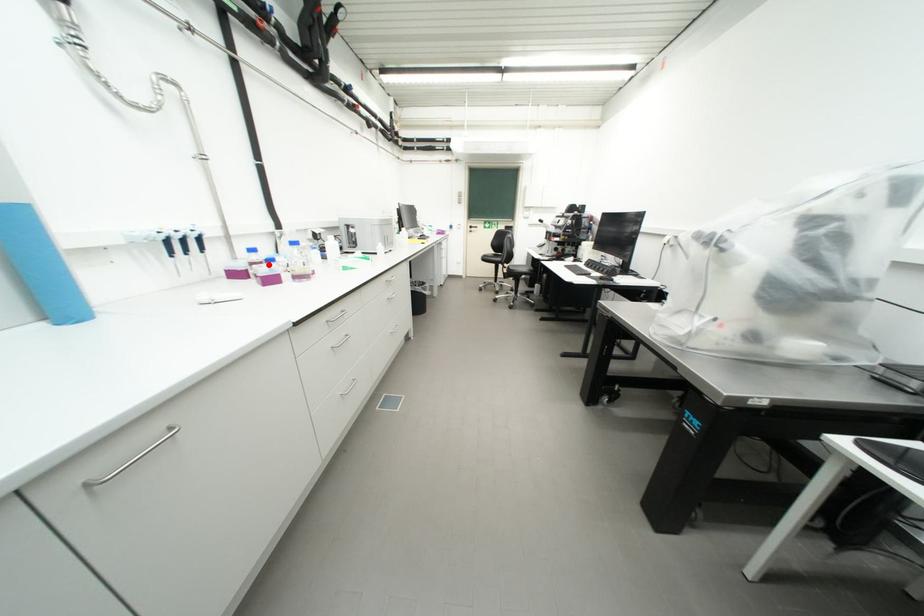
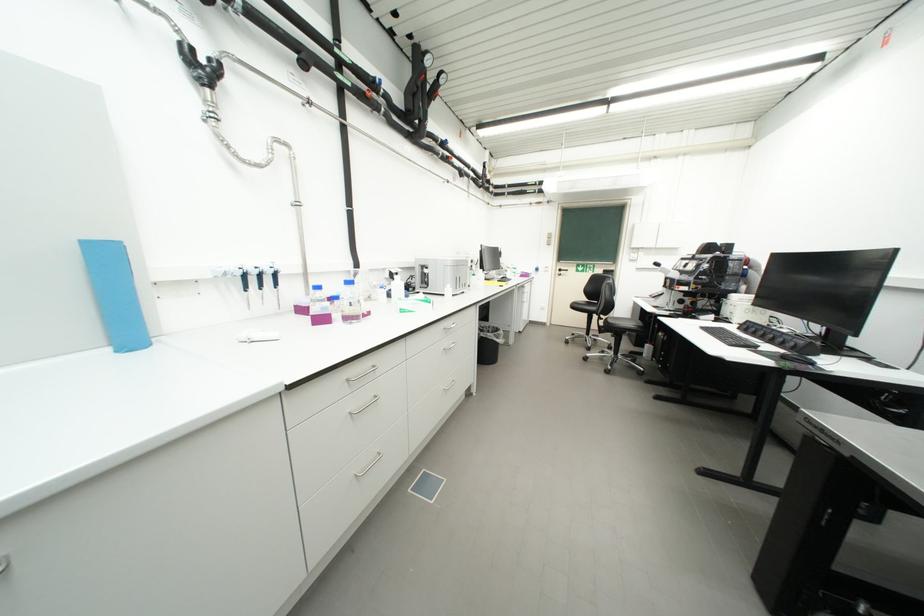
The point at the highlighted location is marked in the first image. Where is the corresponding point in the second image?

(330, 302)